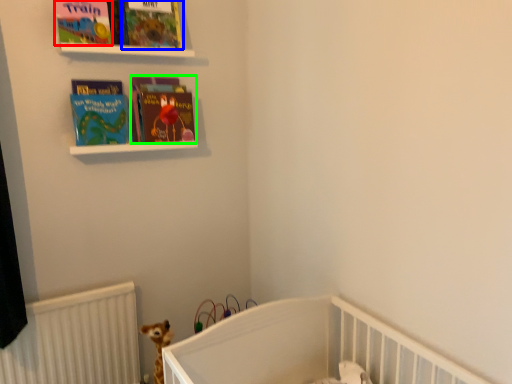
Question: Which is farther away from book cover (highlighted by a red box)? book cover (highlighted by a blue box) or book (highlighted by a green box)?

Choices:
 (A) book cover
 (B) book

Answer: (B)